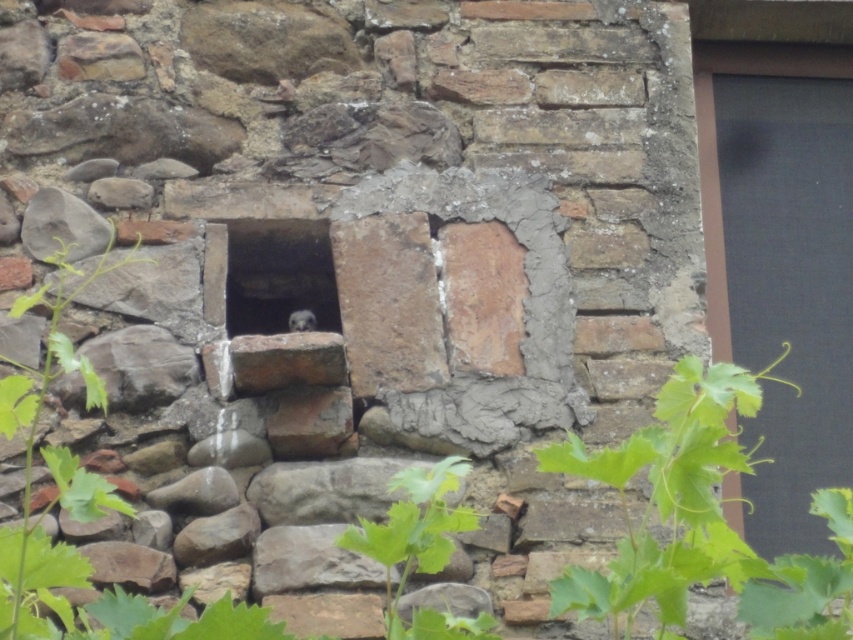
Between point (720, 310) and point (260, 300), which one is positioned behind?

The point (720, 310) is more distant.

What do you see at coordinates (780, 237) in the screenshot?
I see `matte black window at right` at bounding box center [780, 237].

Between point (790, 540) and point (253, 288), which one is positioned in front?

Positioned in front is point (790, 540).

Locate an element on the screen. The width and height of the screenshot is (853, 640). matte black window at right is located at coordinates (780, 237).